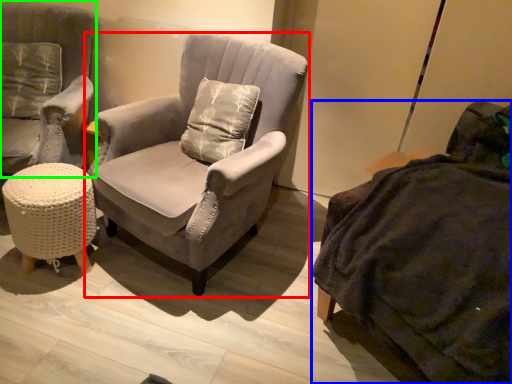
Question: Which object is the closest to the chair (highlighted by a red box)? Choose among these: studio couch (highlighted by a blue box) or chair (highlighted by a green box).

Choices:
 (A) studio couch
 (B) chair

Answer: (B)